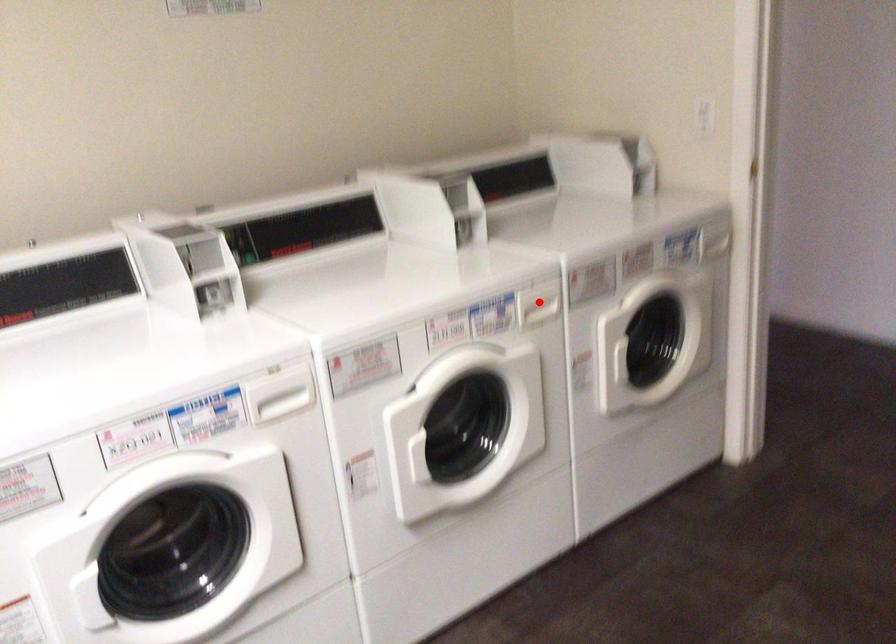
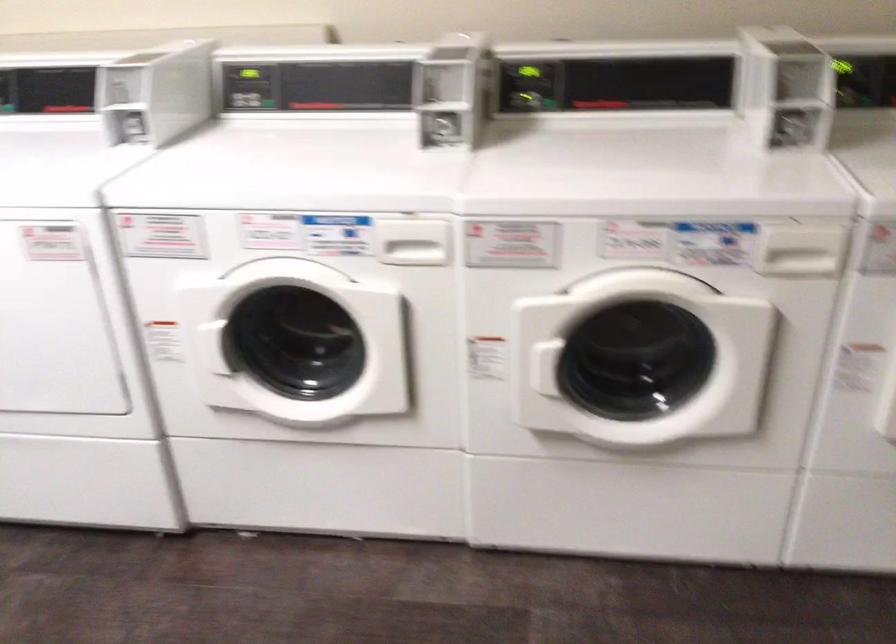
Question: I am providing you with two images of the same scene from different viewpoints. Given a red point in image1, look at the same physical point in image2. Is it:

Choices:
 (A) Closer to the viewpoint
 (B) Farther from the viewpoint

Answer: (A)